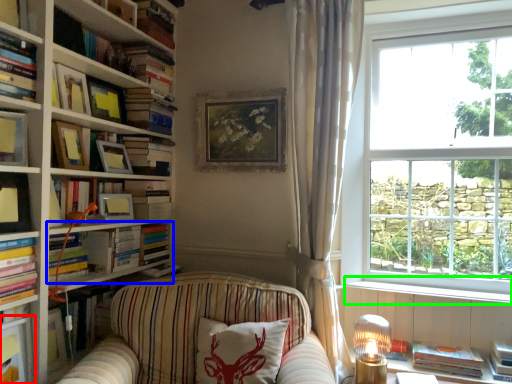
Question: Estimate the real-world distances between objects in this image. Which object is closer to shelf (highlighted by a red box), book (highlighted by a blue box) or window sill (highlighted by a green box)?

Choices:
 (A) book
 (B) window sill

Answer: (A)